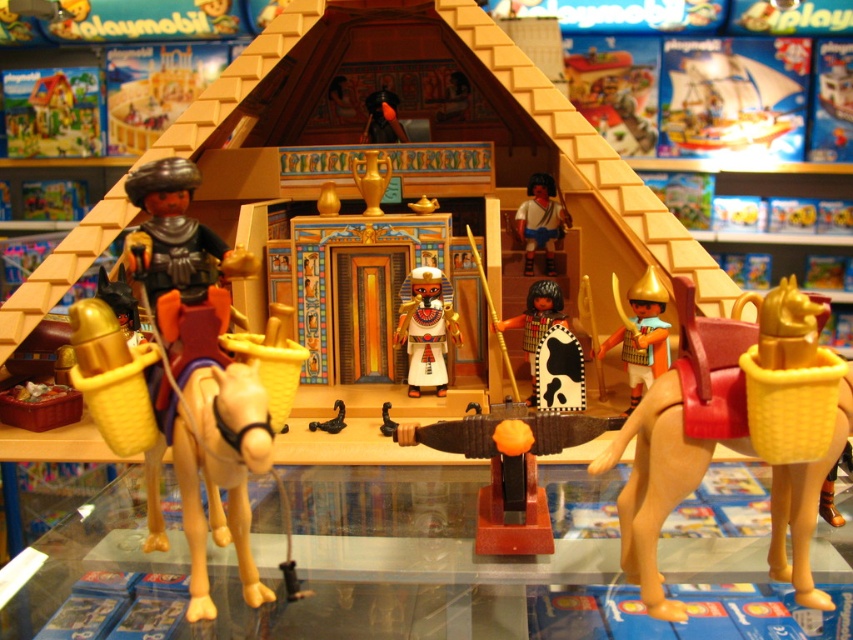
Question: Is gold metallic helmet at right thinner than cowhide shield at center?

Choices:
 (A) no
 (B) yes

Answer: (B)

Question: Which point is farther from the camera taking this photo?

Choices:
 (A) (635, 380)
 (B) (535, 193)

Answer: (B)

Question: Is white matte figure at center wider than cowhide shield at center?

Choices:
 (A) no
 (B) yes

Answer: (A)

Question: Which object is the farthest from the cowhide shield at center?

Choices:
 (A) matte gold pharaoh at center
 (B) tan matte camel at right
 (C) white matte figure at center

Answer: (B)

Question: Considering the relative positions of gold metallic helmet at right and white matte figure at center in the image provided, where is gold metallic helmet at right located with respect to white matte figure at center?

Choices:
 (A) right
 (B) left

Answer: (A)

Question: Which point appears farthest from the camera in this image?

Choices:
 (A) (561, 230)
 (B) (524, 333)
 (C) (631, 506)

Answer: (A)